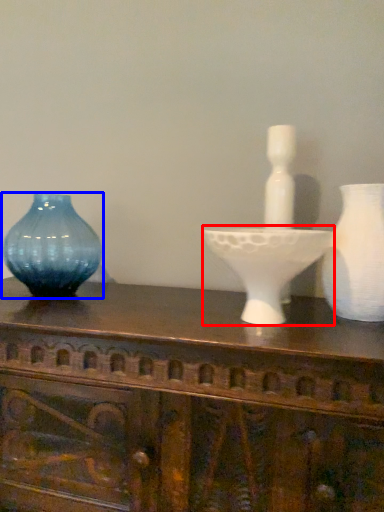
Question: Which of the following is the farthest to the observer, candle holder (highlighted by a red box) or vase (highlighted by a blue box)?

Choices:
 (A) candle holder
 (B) vase

Answer: (B)